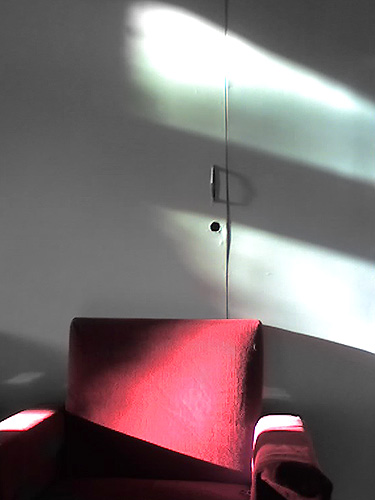
You are a GUI agent. You are given a task and a screenshot of the screen. Output one action in this format:
    pyautogui.click(x=<x>, y=<y>)
    Task: Click on the left armrest
    The image size is (375, 500).
    Given the screenshot: What is the action you would take?
    pyautogui.click(x=274, y=445)